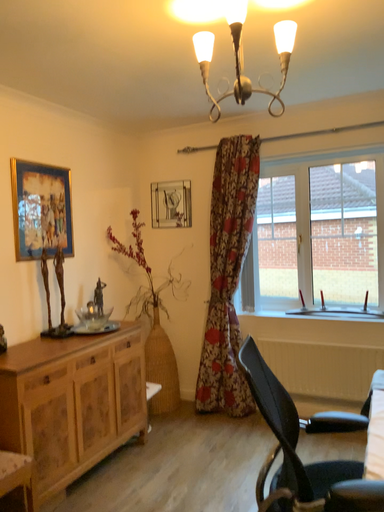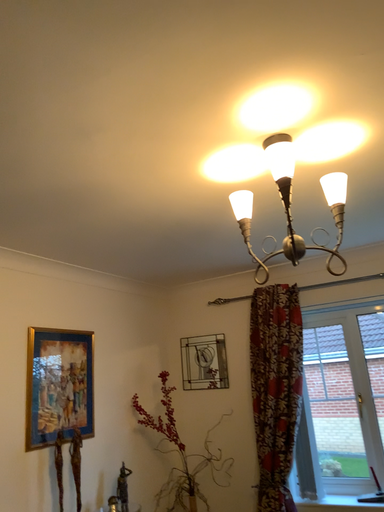
Question: Which way did the camera rotate in the video?

Choices:
 (A) rotated upward
 (B) rotated downward

Answer: (A)